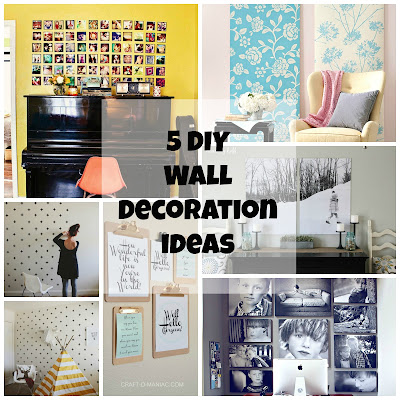
Identify the location of label: decoration. (120, 208).